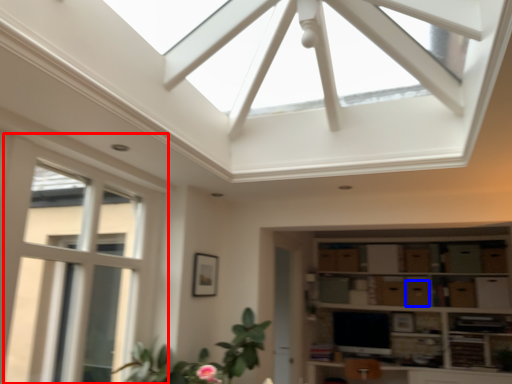
Question: Which object is closer to the camera taking this photo, window (highlighted by a red box) or drawer (highlighted by a blue box)?

Choices:
 (A) window
 (B) drawer

Answer: (A)